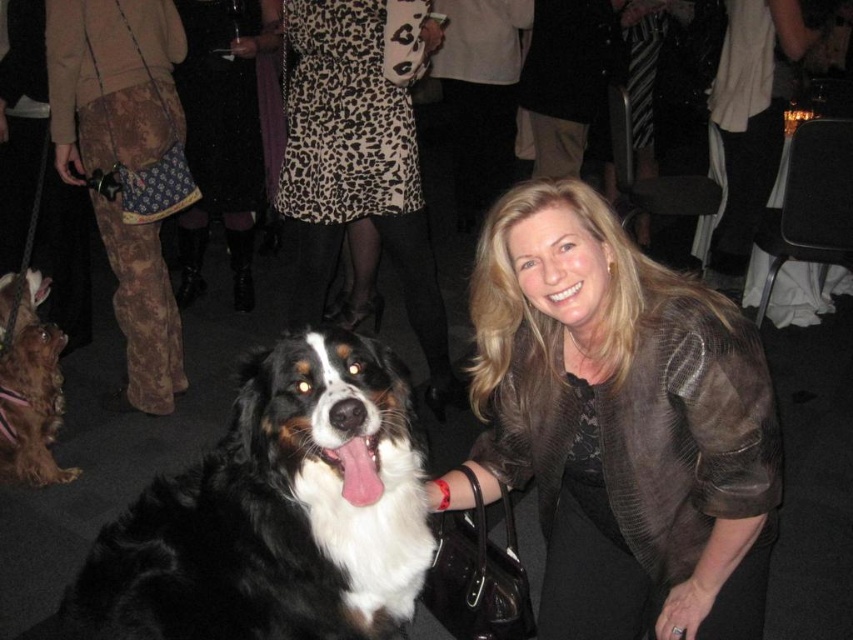
Question: Which object is farther from the camera taking this photo?

Choices:
 (A) brown leather jacket at center
 (B) leopard print dress at center
 (C) black and white fur dog at center

Answer: (B)

Question: Based on their relative distances, which object is farther from the shiny brown fur at lower left?

Choices:
 (A) leopard print dress at center
 (B) brown leather jacket at center
 (C) black and white fur dog at center

Answer: (B)

Question: Is black and white fur dog at center to the right of shiny brown fur at lower left from the viewer's perspective?

Choices:
 (A) no
 (B) yes

Answer: (B)

Question: Which object is farther from the camera taking this photo?

Choices:
 (A) black and white fur dog at center
 (B) shiny brown fur at lower left
 (C) brown leather jacket at center
 (D) leopard print dress at center

Answer: (B)

Question: Is black and white fur dog at center above leopard print dress at center?

Choices:
 (A) no
 (B) yes

Answer: (A)

Question: Does black and white fur dog at center have a smaller size compared to leopard print dress at center?

Choices:
 (A) no
 (B) yes

Answer: (B)